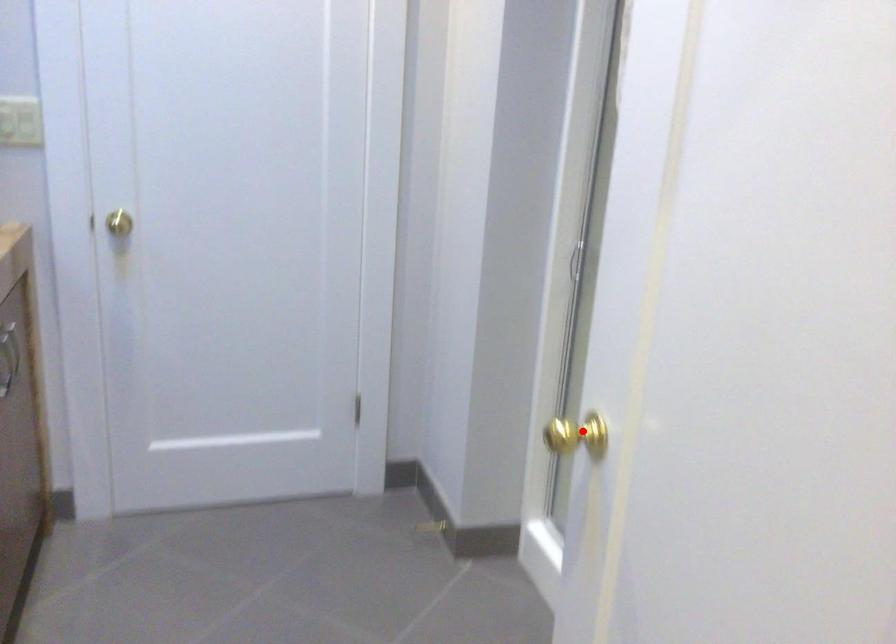
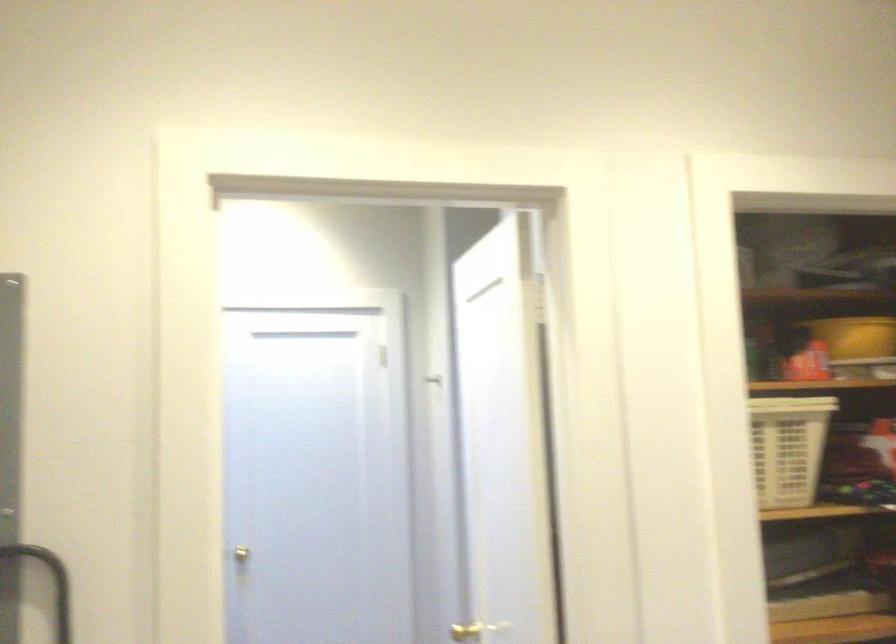
The point at the highlighted location is marked in the first image. Where is the corresponding point in the second image?

(464, 632)